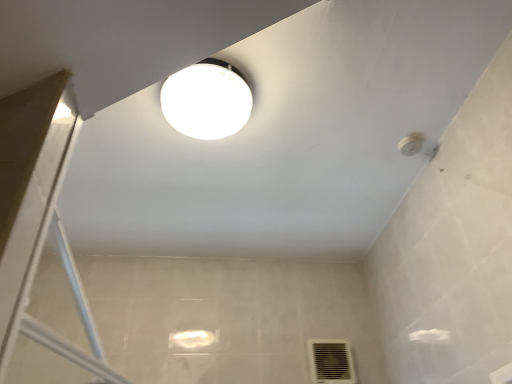
Question: Would you say white glossy lamp at upper center is part of black plastic air conditioning at lower right's contents?

Choices:
 (A) yes
 (B) no

Answer: (B)

Question: Is black plastic air conditioning at lower right behind white glossy lamp at upper center?

Choices:
 (A) no
 (B) yes

Answer: (B)

Question: Does black plastic air conditioning at lower right have a lesser height compared to white glossy lamp at upper center?

Choices:
 (A) no
 (B) yes

Answer: (A)

Question: From a real-world perspective, does black plastic air conditioning at lower right sit lower than white glossy lamp at upper center?

Choices:
 (A) no
 (B) yes

Answer: (B)

Question: From the image's perspective, is black plastic air conditioning at lower right below white glossy lamp at upper center?

Choices:
 (A) no
 (B) yes

Answer: (B)

Question: Does black plastic air conditioning at lower right have a greater height compared to white glossy lamp at upper center?

Choices:
 (A) yes
 (B) no

Answer: (A)

Question: Is white glossy lamp at upper center in front of black plastic air conditioning at lower right?

Choices:
 (A) yes
 (B) no

Answer: (A)

Question: Is black plastic air conditioning at lower right at the back of white glossy lamp at upper center?

Choices:
 (A) no
 (B) yes

Answer: (A)

Question: Is the depth of white glossy lamp at upper center greater than that of black plastic air conditioning at lower right?

Choices:
 (A) no
 (B) yes

Answer: (A)

Question: From the image's perspective, is white glossy lamp at upper center beneath black plastic air conditioning at lower right?

Choices:
 (A) no
 (B) yes

Answer: (A)

Question: Is white glossy lamp at upper center smaller than black plastic air conditioning at lower right?

Choices:
 (A) yes
 (B) no

Answer: (B)

Question: Is white glossy lamp at upper center to the left of black plastic air conditioning at lower right from the viewer's perspective?

Choices:
 (A) yes
 (B) no

Answer: (A)

Question: Considering the positions of point (339, 375) and point (234, 100), is point (339, 375) closer or farther from the camera than point (234, 100)?

Choices:
 (A) farther
 (B) closer

Answer: (A)